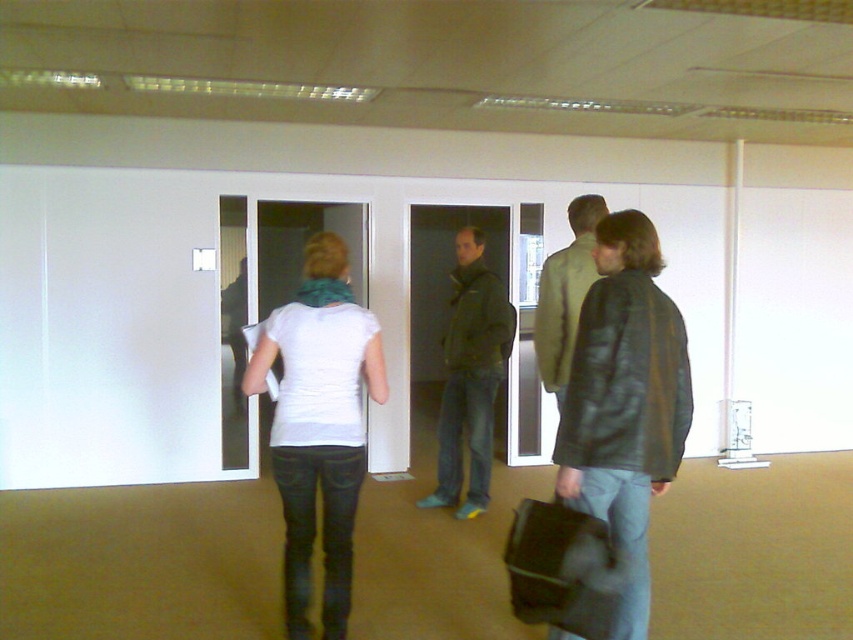
You are an assistant who needs to determine which of the two leather jackets is bigger. You see the leather jacket at right and the light brown leather jacket at center. Which one is larger?

The leather jacket at right is larger compared to the light brown leather jacket at center according to the description.

You are observing a group of people walking in an office space. You notice a white matte shirt at center and a light brown leather jacket at center. Which clothing item is positioned lower on the person?

The white matte shirt at center is below the light brown leather jacket at center, so the white matte shirt at center is positioned lower.

You are an employee in the office and need to choose between two leather jackets available in the store. The jackets are the leather jacket at right and the light brown leather jacket at center. Which one is wider?

The leather jacket at right is wider than the light brown leather jacket at center.